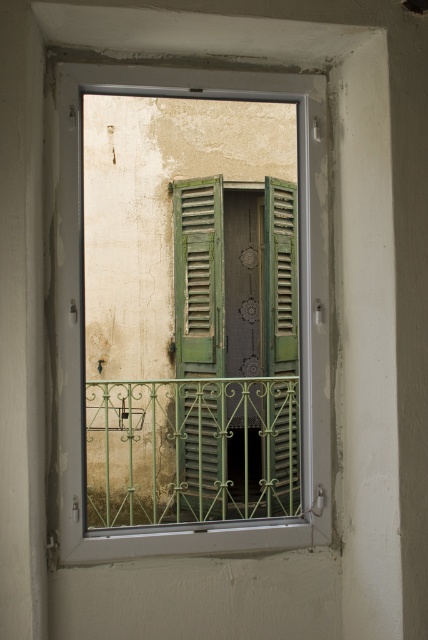
Based on the photo, you are an interior designer assessing the exterior of a building through a window. You notice the green wooden shutters at center and the green wrought iron balcony at center. Which object would cast a larger shadow on the wall behind them during midday?

The green wooden shutters at center is bigger than the green wrought iron balcony at center, so it would cast a larger shadow on the wall behind them during midday.

You are an interior designer assessing the space between the green matte shutters at center and the green wrought iron balcony at center. Which object is wider?

The green wrought iron balcony at center is wider than the green matte shutters at center.